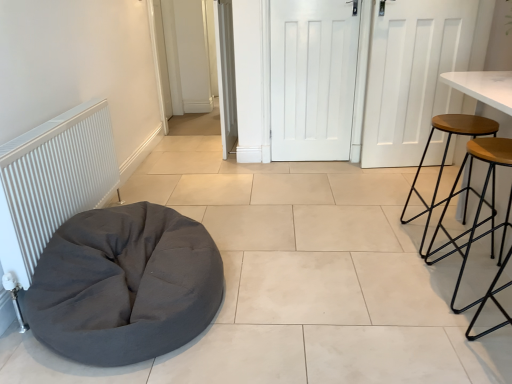
Locate an element on the screen. The image size is (512, 384). vacant space to the left of wooden seat stool at right, the first stool in the back-to-front sequence is located at coordinates (383, 242).